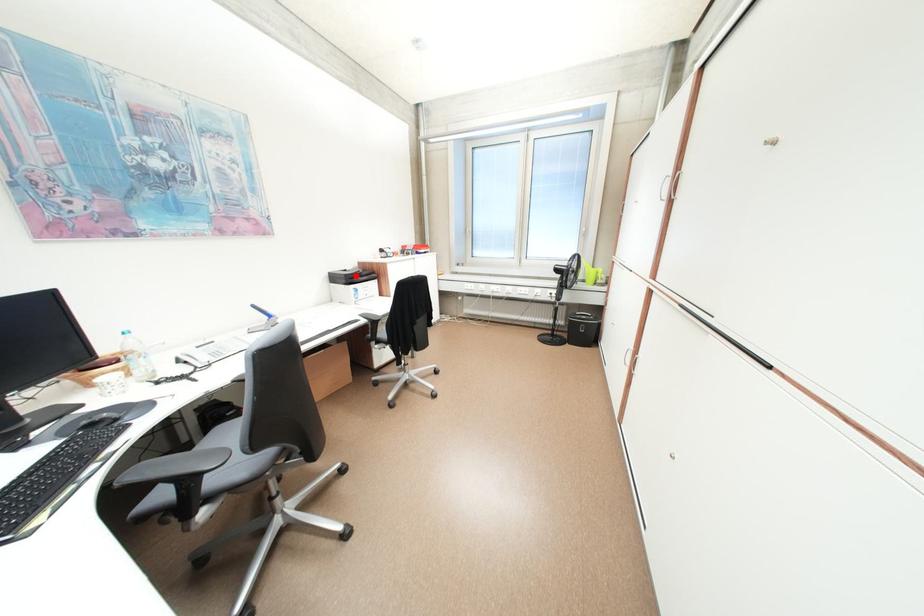
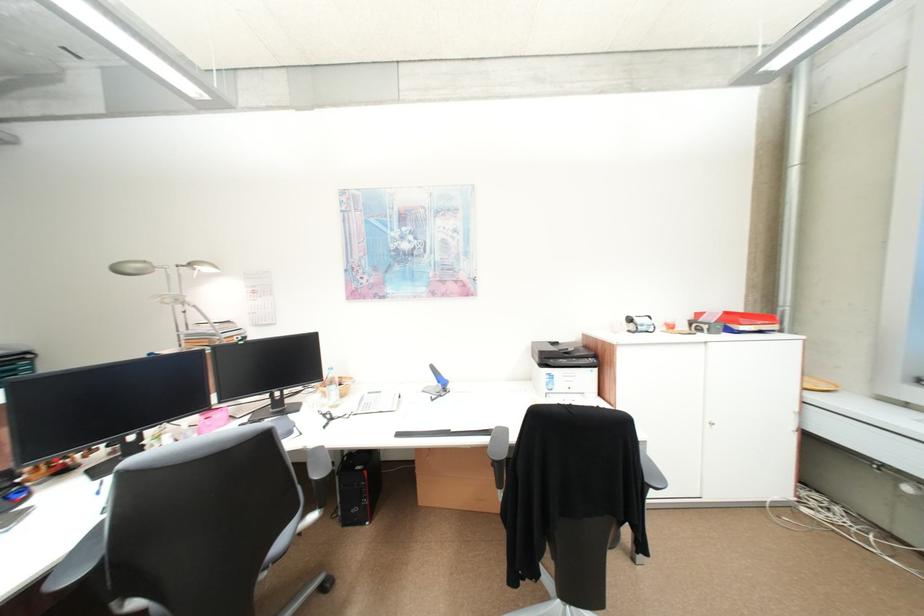
Locate, in the second image, the point that corresponds to the highlighted location in the first image.

(551, 353)